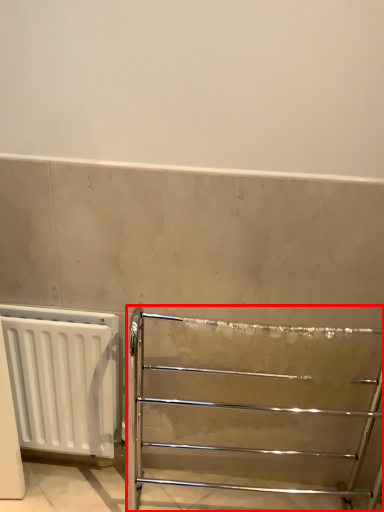
Question: From the image's perspective, what is the correct spatial relationship of furniture (annotated by the red box) in relation to radiator?

Choices:
 (A) below
 (B) above

Answer: (A)